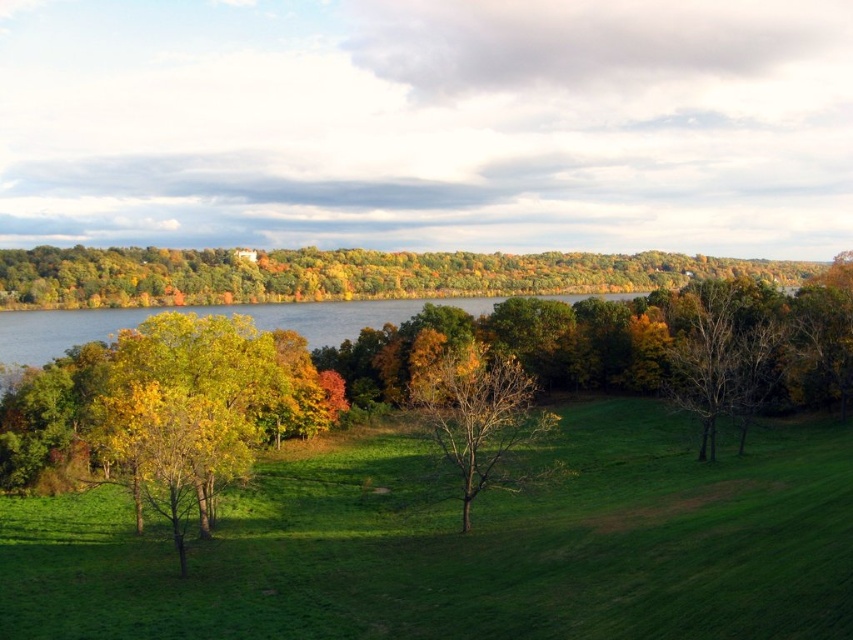
Question: Which point appears closest to the camera in this image?

Choices:
 (A) (334, 468)
 (B) (722, 323)
 (C) (515, 257)
 (D) (310, 326)

Answer: (A)

Question: Is green leafy tree at upper center smaller than green water at center?

Choices:
 (A) no
 (B) yes

Answer: (A)

Question: Which object is farther from the camera taking this photo?

Choices:
 (A) green grassy field at center
 (B) bare branches at center right
 (C) green water at center
 (D) green leafy tree at upper center

Answer: (D)

Question: Can you confirm if green grassy field at center is positioned above bare branches at center right?

Choices:
 (A) no
 (B) yes

Answer: (A)

Question: In this image, where is green leafy tree at upper center located relative to bare branches at center right?

Choices:
 (A) left
 (B) right

Answer: (A)

Question: Which object appears closest to the camera in this image?

Choices:
 (A) green water at center
 (B) bare branches at center right

Answer: (B)